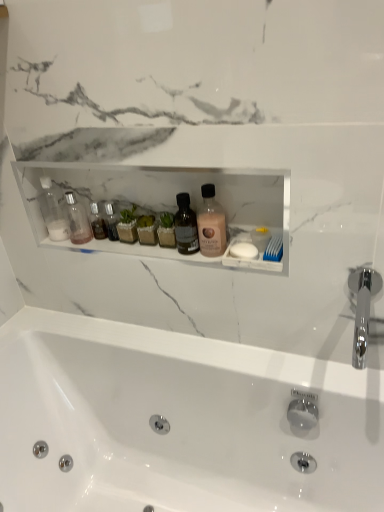
Question: From a real-world perspective, is clear glass bottle at left, the 2th toiletry when ordered from left to right, physically above chrome metallic faucet at right?

Choices:
 (A) no
 (B) yes

Answer: (B)

Question: Can you confirm if clear glass bottle at left, the 2th toiletry when ordered from left to right, is positioned to the left of chrome metallic faucet at right?

Choices:
 (A) no
 (B) yes

Answer: (B)

Question: From the image's perspective, is clear glass bottle at left, the 2th toiletry when ordered from left to right, above chrome metallic faucet at right?

Choices:
 (A) yes
 (B) no

Answer: (A)

Question: Could you tell me if clear glass bottle at left, the 2th toiletry when ordered from left to right, is turned towards chrome metallic faucet at right?

Choices:
 (A) no
 (B) yes

Answer: (A)

Question: Is clear glass bottle at left, the 2th toiletry when ordered from left to right, to the right of chrome metallic faucet at right from the viewer's perspective?

Choices:
 (A) yes
 (B) no

Answer: (B)

Question: Based on their positions, is transparent plastic bottle at left, which is the second toiletry in right-to-left order, located to the left or right of white glossy bathtub at center?

Choices:
 (A) left
 (B) right

Answer: (A)

Question: Do you think transparent plastic bottle at left, positioned as the 1th toiletry in left-to-right order, is within white glossy bathtub at center, or outside of it?

Choices:
 (A) inside
 (B) outside

Answer: (B)

Question: From a real-world perspective, is transparent plastic bottle at left, which is the second toiletry in right-to-left order, physically located above or below white glossy bathtub at center?

Choices:
 (A) below
 (B) above

Answer: (B)

Question: Considering the positions of transparent plastic bottle at left, positioned as the 1th toiletry in left-to-right order, and white glossy bathtub at center in the image, is transparent plastic bottle at left, positioned as the 1th toiletry in left-to-right order, wider or thinner than white glossy bathtub at center?

Choices:
 (A) thin
 (B) wide

Answer: (A)

Question: Considering the positions of chrome metallic faucet at right and pink matte lotion at center in the image, is chrome metallic faucet at right wider or thinner than pink matte lotion at center?

Choices:
 (A) thin
 (B) wide

Answer: (B)

Question: Is point pyautogui.click(x=360, y=306) positioned closer to the camera than point pyautogui.click(x=220, y=215)?

Choices:
 (A) farther
 (B) closer

Answer: (B)

Question: From the image's perspective, is chrome metallic faucet at right above or below pink matte lotion at center?

Choices:
 (A) above
 (B) below

Answer: (B)

Question: Considering the positions of chrome metallic faucet at right and pink matte lotion at center in the image, is chrome metallic faucet at right bigger or smaller than pink matte lotion at center?

Choices:
 (A) big
 (B) small

Answer: (A)

Question: Do you think transparent plastic bottle at left, which is the second toiletry in right-to-left order, is within clear glass bottle at left, the 2th toiletry when ordered from left to right, or outside of it?

Choices:
 (A) inside
 (B) outside

Answer: (B)

Question: From a real-world perspective, relative to clear glass bottle at left, the 2th toiletry when ordered from left to right, is transparent plastic bottle at left, which is the second toiletry in right-to-left order, vertically above or below?

Choices:
 (A) above
 (B) below

Answer: (A)